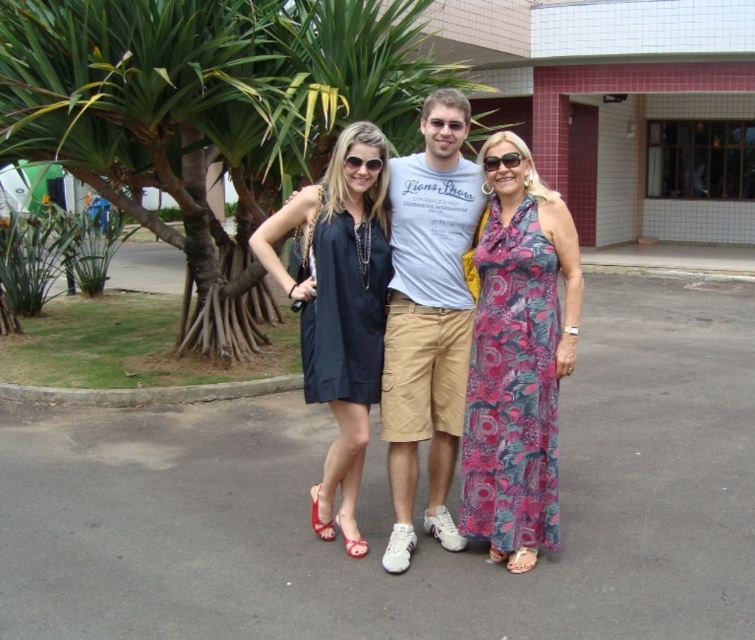
Which is below, light gray cotton t-shirt at center or satin black dress at center?

satin black dress at center

The height and width of the screenshot is (640, 755). What do you see at coordinates (427, 320) in the screenshot?
I see `light gray cotton t-shirt at center` at bounding box center [427, 320].

Who is more forward, (439, 113) or (350, 397)?

Point (350, 397) is in front.

In order to click on light gray cotton t-shirt at center in this screenshot , I will do `click(427, 320)`.

In the scene shown: Can you confirm if green leafy palm tree at center is positioned to the right of light gray cotton t-shirt at center?

Incorrect, green leafy palm tree at center is not on the right side of light gray cotton t-shirt at center.

Can you confirm if green leafy palm tree at center is wider than light gray cotton t-shirt at center?

Indeed, green leafy palm tree at center has a greater width compared to light gray cotton t-shirt at center.

Is point (74, 44) in front of point (393, 385)?

No, it is not.

Locate an element on the screen. Image resolution: width=755 pixels, height=640 pixels. green leafy palm tree at center is located at coordinates (207, 100).

Is green leafy palm tree at center positioned in front of satin black dress at center?

No, green leafy palm tree at center is behind satin black dress at center.

The width and height of the screenshot is (755, 640). Identify the location of green leafy palm tree at center. (207, 100).

Find the location of a particular element. The width and height of the screenshot is (755, 640). green leafy palm tree at center is located at coordinates (207, 100).